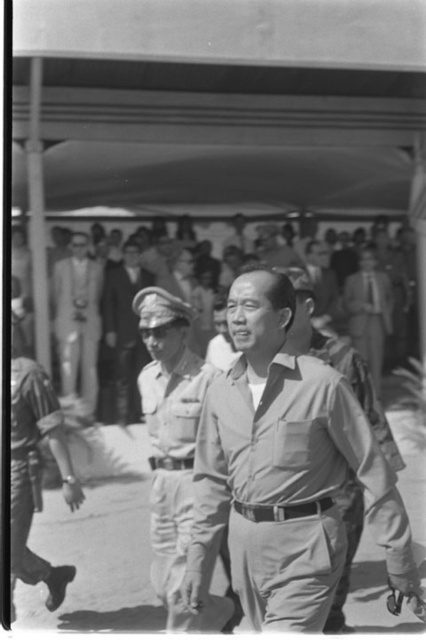
You are a photographer standing at the camera position. You want to take a closeup shot of the light beige uniform at center. Can you estimate how far you need to move forward to get a closer shot?

The light beige uniform at center is 8.97 meters from the camera. To get a closer shot, you would need to move forward approximately 8.97 meters towards it.

You are a photographer at the event and need to capture a photo of both the matte khaki pants at center and the light brown leather jacket at lower left. Based on their positions, which object is closer to the camera?

The light brown leather jacket at lower left is closer to the camera than the matte khaki pants at center because objects at lower positions in a photo are typically closer to the viewer.

You are a photographer at the event and want to capture a clear photo of the light beige uniform at center without the light gray uniform at center blocking it. What should you do?

Move the camera upwards to position the light beige uniform at center above the light gray uniform at center, as the light beige uniform at center is already positioned over the light gray uniform at center.